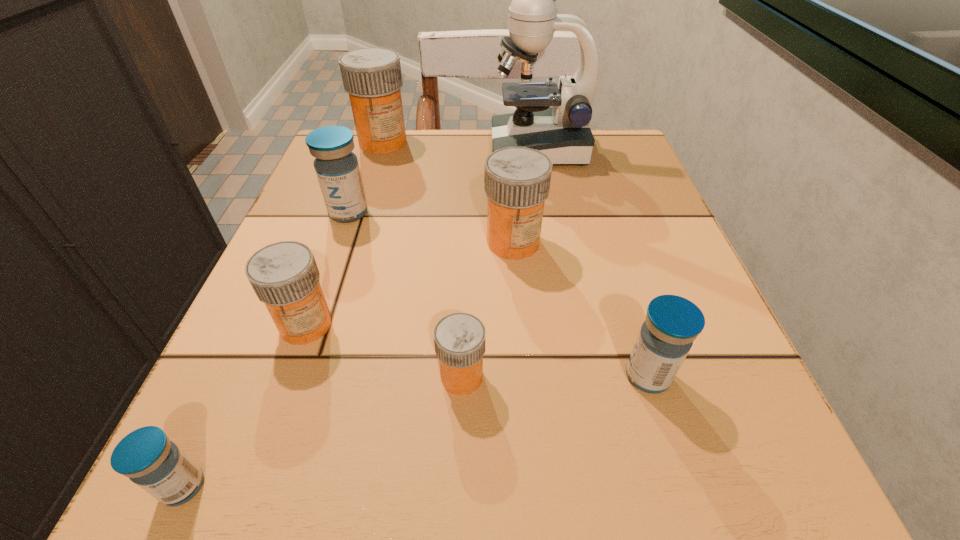
Image resolution: width=960 pixels, height=540 pixels. I want to click on the tallest object, so click(562, 132).

Find the location of a particular element. This screenshot has height=540, width=960. the tallest medicine is located at coordinates (372, 76).

The image size is (960, 540). I want to click on the biggest orange medicine, so click(372, 76).

The width and height of the screenshot is (960, 540). I want to click on the second blue medicine from right to left, so click(336, 166).

Find the location of `the farthest blue medicine`. the farthest blue medicine is located at coordinates (336, 166).

At what (x,y) coordinates should I click in order to perform the action: click on the rightmost orange medicine. Please return your answer as a coordinate pair (x, y). Looking at the image, I should click on (517, 180).

Find the location of a particular element. The image size is (960, 540). the sixth medicine from left to right is located at coordinates (517, 180).

Identify the location of the third farthest orange medicine. (284, 275).

You are a GUI agent. You are given a task and a screenshot of the screen. Output one action in this format:
    pyautogui.click(x=<x>, y=<y>)
    Task: Click on the fourth nearest object
    The image size is (960, 540).
    Given the screenshot: What is the action you would take?
    pyautogui.click(x=284, y=275)

The height and width of the screenshot is (540, 960). I want to click on the second smallest blue medicine, so click(x=672, y=323).